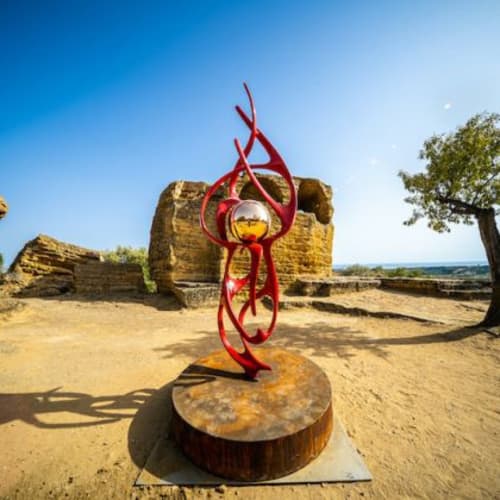
This screenshot has height=500, width=500. Find the location of `artwork`. artwork is located at coordinates [x=261, y=412].